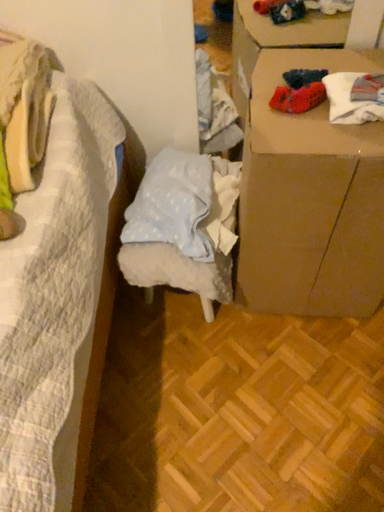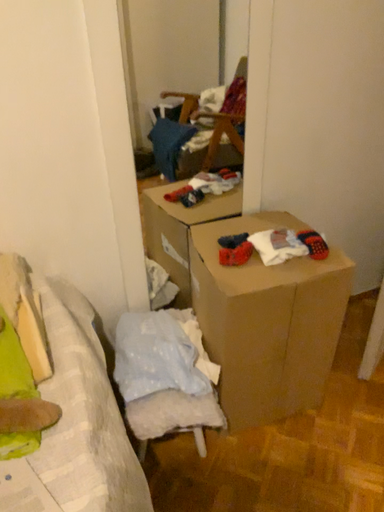
Question: How did the camera likely rotate when shooting the video?

Choices:
 (A) rotated left
 (B) rotated right

Answer: (B)